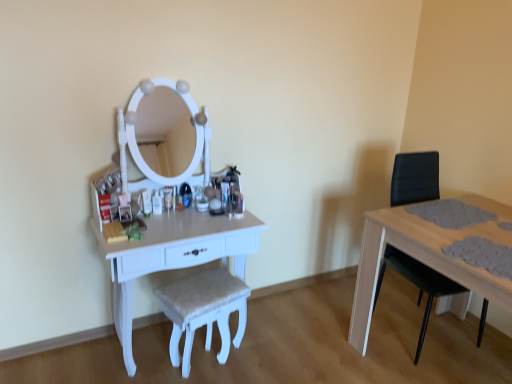
Find the location of `black leather swivel chair at right`. black leather swivel chair at right is located at coordinates (417, 284).

The height and width of the screenshot is (384, 512). Describe the element at coordinates (203, 311) in the screenshot. I see `white textured stool at center` at that location.

Image resolution: width=512 pixels, height=384 pixels. Describe the element at coordinates (174, 256) in the screenshot. I see `white glossy table at left` at that location.

This screenshot has height=384, width=512. I want to click on black leather swivel chair at right, so click(x=417, y=284).

Between white glossy table at left and white textured stool at center, which one has less height?

With less height is white textured stool at center.

Which of these two, white glossy table at left or white textured stool at center, is wider?

Wider between the two is white glossy table at left.

Is white glossy table at left positioned with its back to white textured stool at center?

Yes, white glossy table at left is facing away from white textured stool at center.

Can you confirm if white glossy table at left is positioned to the right of white textured stool at center?

Incorrect, white glossy table at left is not on the right side of white textured stool at center.

Considering the relative sizes of white textured stool at center and white glossy table at left in the image provided, is white textured stool at center bigger than white glossy table at left?

No, white textured stool at center is not bigger than white glossy table at left.

Is white textured stool at center in contact with white glossy table at left?

No, white textured stool at center is not next to white glossy table at left.

Is white textured stool at center looking in the opposite direction of white glossy table at left?

Yes, white glossy table at left is at the back of white textured stool at center.

Considering the sizes of objects white textured stool at center and white glossy table at left in the image provided, who is thinner, white textured stool at center or white glossy table at left?

With smaller width is white textured stool at center.

Image resolution: width=512 pixels, height=384 pixels. I want to click on swivel chair that is on the right side of white glossy table at left, so click(x=417, y=284).

Between point (169, 227) and point (422, 266), which one is positioned behind?

The point (422, 266) is farther.

From a real-world perspective, between white glossy table at left and black leather swivel chair at right, who is vertically higher?

black leather swivel chair at right.

Is black leather swivel chair at right facing towards white glossy table at left?

No, black leather swivel chair at right is not oriented towards white glossy table at left.

Does black leather swivel chair at right contain white glossy table at left?

Actually, white glossy table at left is outside black leather swivel chair at right.

Can you confirm if black leather swivel chair at right is shorter than white glossy table at left?

Incorrect, the height of black leather swivel chair at right does not fall short of that of white glossy table at left.

Between black leather swivel chair at right and white textured stool at center, which one appears on the left side from the viewer's perspective?

white textured stool at center is more to the left.

Who is bigger, black leather swivel chair at right or white textured stool at center?

With larger size is black leather swivel chair at right.

Between black leather swivel chair at right and white textured stool at center, which one has more height?

black leather swivel chair at right is taller.

Could you tell me if black leather swivel chair at right is turned towards white textured stool at center?

No, black leather swivel chair at right is not aimed at white textured stool at center.

Is white textured stool at center looking in the opposite direction of black leather swivel chair at right?

No.

Is white textured stool at center thinner than black leather swivel chair at right?

Indeed, white textured stool at center has a lesser width compared to black leather swivel chair at right.

Where is `stool lying below the white glossy table at left (from the image's perspective)`? Image resolution: width=512 pixels, height=384 pixels. stool lying below the white glossy table at left (from the image's perspective) is located at coordinates (203, 311).

Image resolution: width=512 pixels, height=384 pixels. I want to click on table that appears in front of the white textured stool at center, so click(174, 256).

Looking at the image, which one is located closer to white textured stool at center, black leather swivel chair at right or white glossy table at left?

The object closer to white textured stool at center is white glossy table at left.

From the image, which object appears to be farther from white glossy table at left, white textured stool at center or black leather swivel chair at right?

Based on the image, black leather swivel chair at right appears to be further to white glossy table at left.

In the scene shown: From the image, which object appears to be farther from black leather swivel chair at right, white glossy table at left or white textured stool at center?

white glossy table at left.

From the image, which object appears to be farther from white textured stool at center, white glossy table at left or black leather swivel chair at right?

black leather swivel chair at right.

From the image, which object appears to be farther from white glossy table at left, black leather swivel chair at right or white textured stool at center?

The object further to white glossy table at left is black leather swivel chair at right.

Considering their positions, is white textured stool at center positioned closer to black leather swivel chair at right than white glossy table at left?

white textured stool at center is positioned closer to the anchor black leather swivel chair at right.

The image size is (512, 384). What are the coordinates of `stool between white glossy table at left and black leather swivel chair at right from left to right` in the screenshot? It's located at (203, 311).